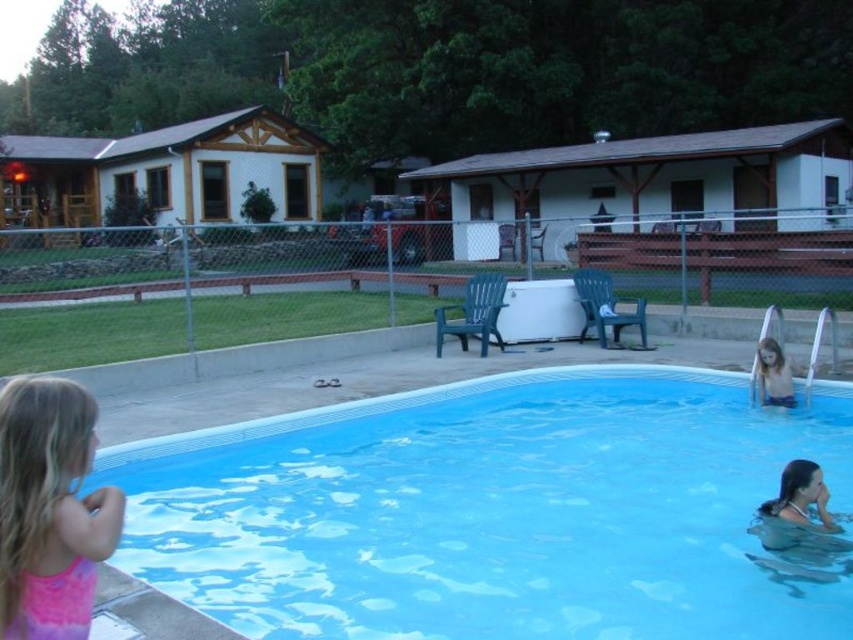
You are a photographer trying to capture a photo of the pink fabric dress at lower left and the smooth skin child at lower right. Since you want both subjects to be clearly visible, which one should you zoom in on more?

You should zoom in more on the pink fabric dress at lower left because it is smaller than the smooth skin child at lower right, making it harder to see details.

You are a photographer setting up a shot of the pink fabric dress at lower left and the smooth skin child at lower right. Which object is narrower?

The pink fabric dress at lower left is narrower than the smooth skin child at lower right.